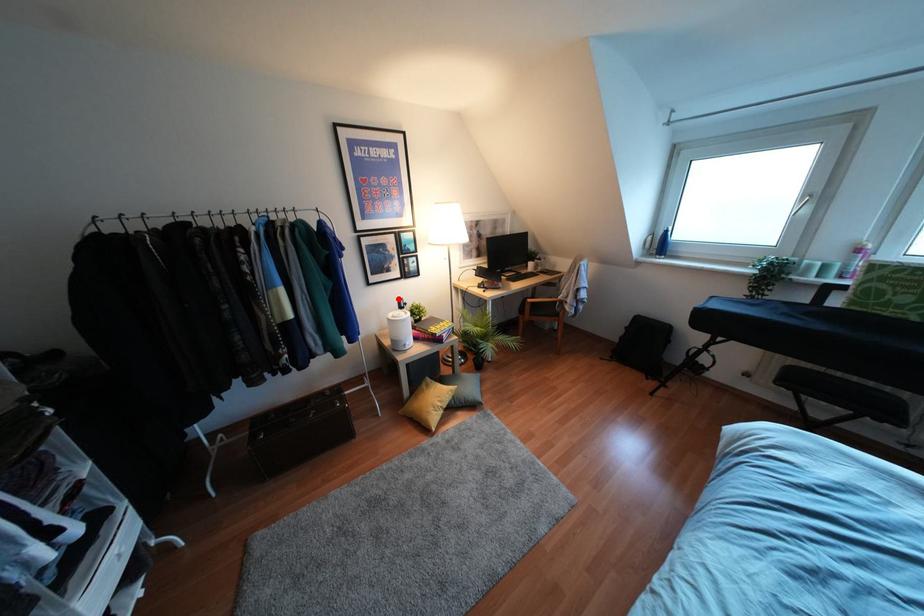
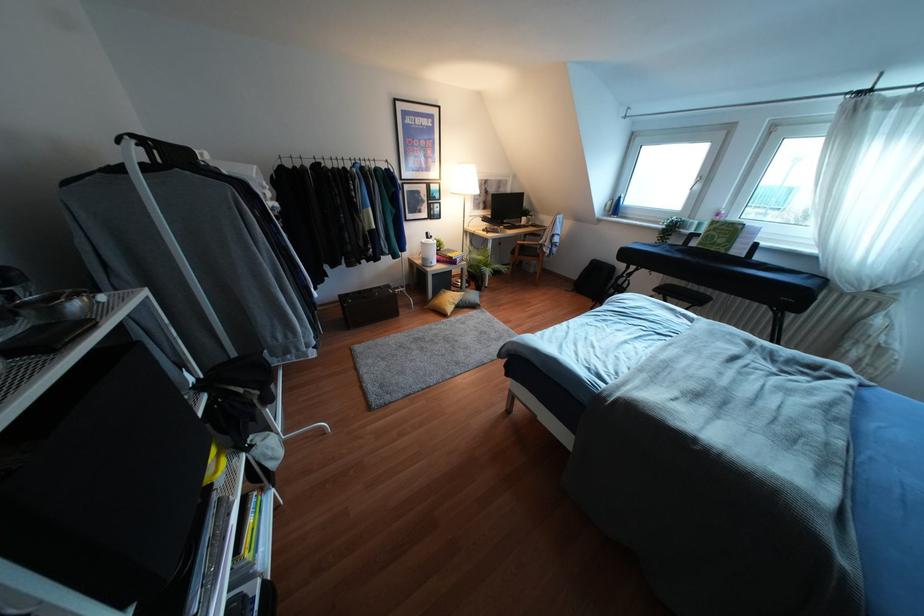
Locate, in the second image, the point that corresponds to the highlighted location in the first image.

(427, 233)